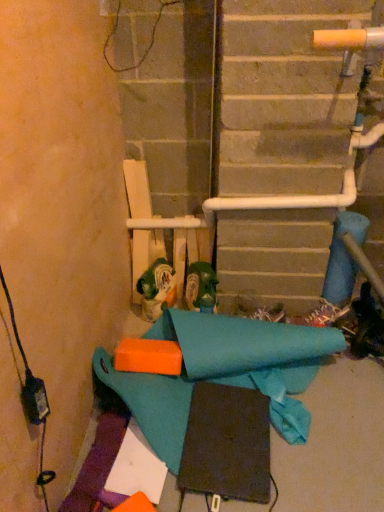
Question: Does green plastic beer can at center lie behind green matte boot at center?

Choices:
 (A) yes
 (B) no

Answer: (A)

Question: Considering the relative sizes of green plastic beer can at center and green matte boot at center in the image provided, is green plastic beer can at center thinner than green matte boot at center?

Choices:
 (A) no
 (B) yes

Answer: (A)

Question: Is green plastic beer can at center looking in the opposite direction of green matte boot at center?

Choices:
 (A) no
 (B) yes

Answer: (A)

Question: Is green plastic beer can at center closer to camera compared to green matte boot at center?

Choices:
 (A) yes
 (B) no

Answer: (B)

Question: Is green plastic beer can at center to the right of green matte boot at center from the viewer's perspective?

Choices:
 (A) yes
 (B) no

Answer: (B)

Question: Does green plastic beer can at center turn towards green matte boot at center?

Choices:
 (A) no
 (B) yes

Answer: (A)

Question: From the image's perspective, is green matte boot at center beneath green plastic beer can at center?

Choices:
 (A) no
 (B) yes

Answer: (B)

Question: Can you confirm if green matte boot at center is wider than green plastic beer can at center?

Choices:
 (A) no
 (B) yes

Answer: (A)

Question: Is green matte boot at center directly adjacent to green plastic beer can at center?

Choices:
 (A) no
 (B) yes

Answer: (A)

Question: Is green matte boot at center thinner than green plastic beer can at center?

Choices:
 (A) yes
 (B) no

Answer: (A)

Question: Is green matte boot at center at the left side of green plastic beer can at center?

Choices:
 (A) no
 (B) yes

Answer: (A)

Question: Is green matte boot at center completely or partially outside of green plastic beer can at center?

Choices:
 (A) yes
 (B) no

Answer: (A)

Question: Is green matte boot at center in front of or behind green plastic beer can at center in the image?

Choices:
 (A) behind
 (B) front

Answer: (B)